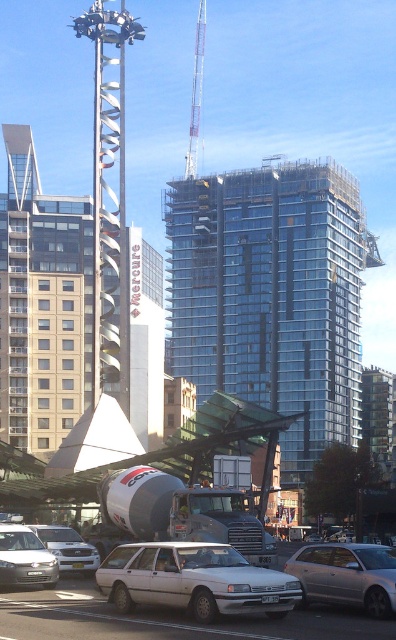
Does transparent glass building at center come in front of silver metallic sedan at center?

That is False.

Is transparent glass building at center further to the viewer compared to silver metallic sedan at center?

Yes.

This screenshot has width=396, height=640. Describe the element at coordinates (272, 296) in the screenshot. I see `transparent glass building at center` at that location.

The height and width of the screenshot is (640, 396). In order to click on transparent glass building at center in this screenshot , I will do `click(272, 296)`.

Who is shorter, silver metallic sedan at lower left or white matte sedan at lower left?

With less height is silver metallic sedan at lower left.

Measure the distance between silver metallic sedan at lower left and camera.

silver metallic sedan at lower left is 101.47 feet from camera.

Is point (11, 566) positioned after point (57, 552)?

No, (11, 566) is in front of (57, 552).

Find the location of `silver metallic sedan at lower left`. silver metallic sedan at lower left is located at coordinates (24, 557).

Who is shorter, white matte wagon at center or metallic gray crane at upper center?

white matte wagon at center is shorter.

Is white matte wagon at center further to the viewer compared to metallic gray crane at upper center?

No.

This screenshot has height=640, width=396. What are the coordinates of `white matte wagon at center` in the screenshot? It's located at (194, 579).

At what (x,y) coordinates should I click in order to perform the action: click on white matte wagon at center. Please return your answer as a coordinate pair (x, y). Looking at the image, I should click on (194, 579).